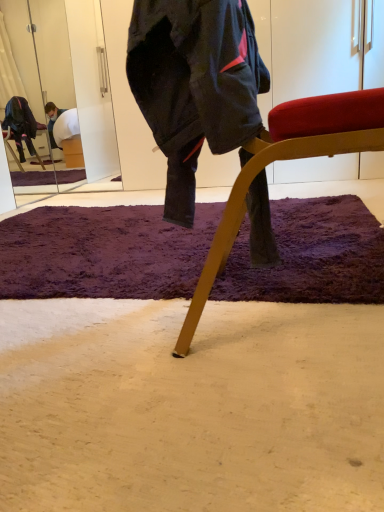
Question: Would you say wooden chair at center is outside purple shaggy rug at center?

Choices:
 (A) yes
 (B) no

Answer: (A)

Question: From the image's perspective, is wooden chair at center located above purple shaggy rug at center?

Choices:
 (A) yes
 (B) no

Answer: (A)

Question: From a real-world perspective, is wooden chair at center below purple shaggy rug at center?

Choices:
 (A) yes
 (B) no

Answer: (B)

Question: Is wooden chair at center facing towards purple shaggy rug at center?

Choices:
 (A) no
 (B) yes

Answer: (A)

Question: Is wooden chair at center far away from purple shaggy rug at center?

Choices:
 (A) no
 (B) yes

Answer: (A)

Question: In the image, is dark blue fabric jacket at center positioned in front of or behind purple shaggy rug at center?

Choices:
 (A) front
 (B) behind

Answer: (A)

Question: Based on their sizes in the image, would you say dark blue fabric jacket at center is bigger or smaller than purple shaggy rug at center?

Choices:
 (A) big
 (B) small

Answer: (B)

Question: Would you say dark blue fabric jacket at center is to the left or to the right of purple shaggy rug at center in the picture?

Choices:
 (A) left
 (B) right

Answer: (B)

Question: From the image's perspective, is dark blue fabric jacket at center positioned above or below purple shaggy rug at center?

Choices:
 (A) below
 (B) above

Answer: (B)

Question: In the image, is purple shaggy rug at center on the left side or the right side of dark blue fabric jacket at center?

Choices:
 (A) right
 (B) left

Answer: (B)

Question: From a real-world perspective, is purple shaggy rug at center positioned above or below dark blue fabric jacket at center?

Choices:
 (A) above
 (B) below

Answer: (B)

Question: Considering the positions of purple shaggy rug at center and dark blue fabric jacket at center in the image, is purple shaggy rug at center wider or thinner than dark blue fabric jacket at center?

Choices:
 (A) thin
 (B) wide

Answer: (B)

Question: Relative to dark blue fabric jacket at center, is purple shaggy rug at center in front or behind?

Choices:
 (A) behind
 (B) front

Answer: (A)

Question: From a real-world perspective, is purple shaggy rug at center physically located above or below wooden chair at center?

Choices:
 (A) below
 (B) above

Answer: (A)

Question: Is purple shaggy rug at center in front of or behind wooden chair at center in the image?

Choices:
 (A) front
 (B) behind

Answer: (B)